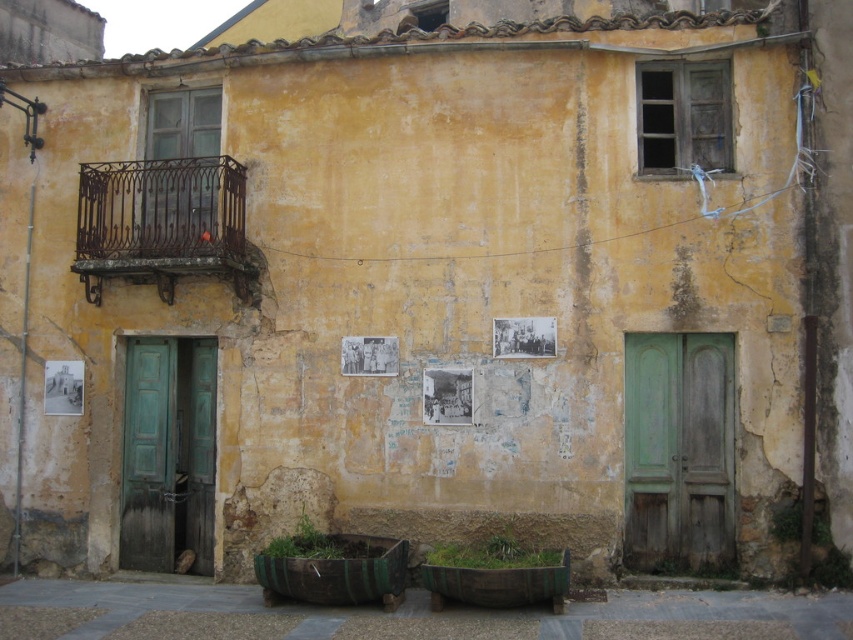
Measure the distance between green wood door at right and camera.

They are 10.74 meters apart.

Is green wood door at right to the left of wrought iron balcony at upper left from the viewer's perspective?

No, green wood door at right is not to the left of wrought iron balcony at upper left.

Does point (645, 424) come closer to viewer compared to point (231, 241)?

Yes, it is.

Image resolution: width=853 pixels, height=640 pixels. Find the location of `green wood door at right`. green wood door at right is located at coordinates (677, 451).

Is green wood door at right to the left of green wooden door at lower left from the viewer's perspective?

No, green wood door at right is not to the left of green wooden door at lower left.

Is the position of green wood door at right more distant than that of green wooden door at lower left?

No, it is in front of green wooden door at lower left.

Identify the location of green wood door at right. The width and height of the screenshot is (853, 640). (677, 451).

Which of these two, green wooden door at lower left or wrought iron balcony at upper left, stands shorter?

wrought iron balcony at upper left is shorter.

Based on the photo, does green wooden door at lower left have a greater height compared to wrought iron balcony at upper left?

Yes, green wooden door at lower left is taller than wrought iron balcony at upper left.

Image resolution: width=853 pixels, height=640 pixels. What do you see at coordinates (167, 452) in the screenshot? I see `green wooden door at lower left` at bounding box center [167, 452].

Locate an element on the screen. The image size is (853, 640). green wooden door at lower left is located at coordinates (167, 452).